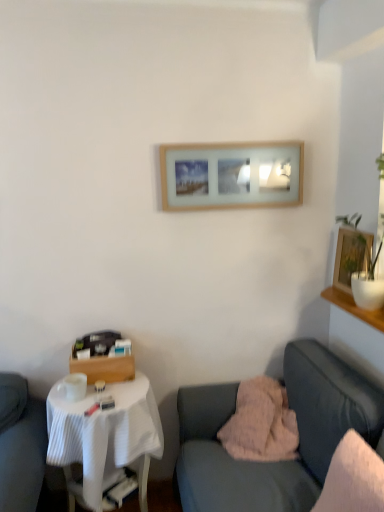
Question: From a real-world perspective, relative to velvet pink blanket at lower right, is fluffy pink pillow at lower center, the second pillow positioned from the front, vertically above or below?

Choices:
 (A) above
 (B) below

Answer: (A)

Question: Relative to velvet pink blanket at lower right, is fluffy pink pillow at lower center, the first pillow viewed from the back, in front or behind?

Choices:
 (A) behind
 (B) front

Answer: (A)

Question: Which is nearer to the white fabric-covered table at lower left?

Choices:
 (A) wooden picture frame at upper center, which ranks as the 2th picture frame in bottom-to-top order
 (B) white soft pillow at right, the 2th pillow positioned from the back
 (C) wooden framed picture at upper right, marked as the first picture frame in a bottom-to-top arrangement
 (D) velvet pink blanket at lower right
 (E) fluffy pink pillow at lower center, the first pillow viewed from the back

Answer: (D)

Question: Estimate the real-world distances between objects in this image. Which object is farther from the fluffy pink pillow at lower center, the second pillow positioned from the front?

Choices:
 (A) white fabric-covered table at lower left
 (B) wooden framed picture at upper right, the 2th picture frame from the top
 (C) wooden picture frame at upper center, arranged as the 1th picture frame when viewed from the top
 (D) white soft pillow at right, the first pillow when ordered from front to back
 (E) velvet pink blanket at lower right

Answer: (C)